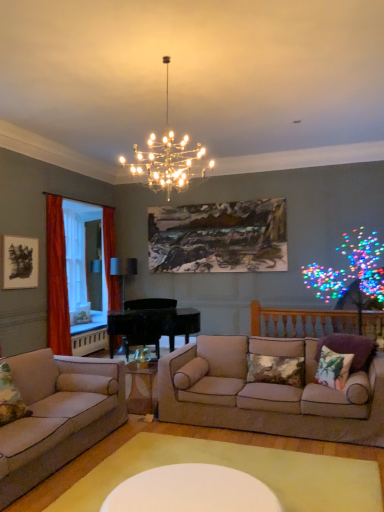
The height and width of the screenshot is (512, 384). I want to click on blank space situated above metallic chandelier at upper center, the second lamp viewed from the left (from a real-world perspective), so click(163, 57).